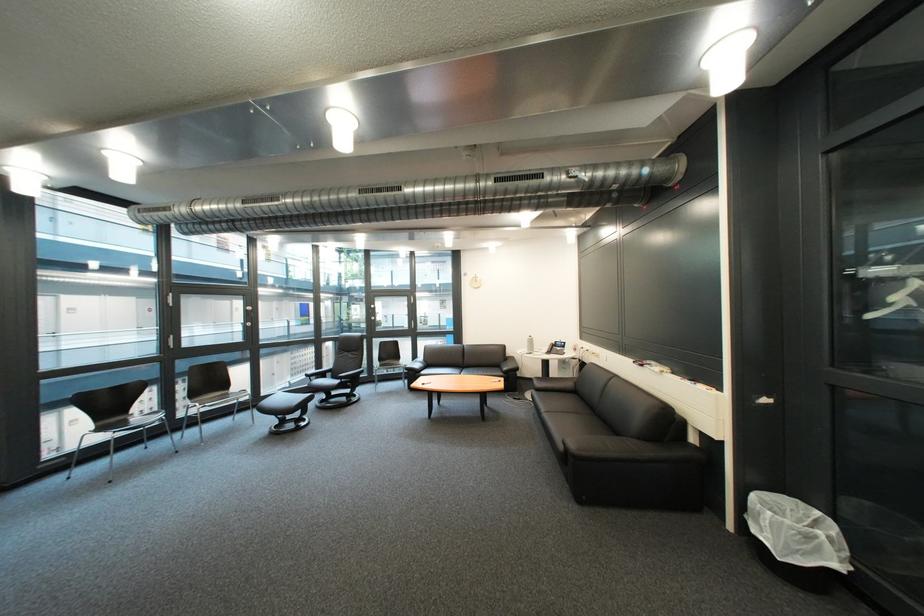
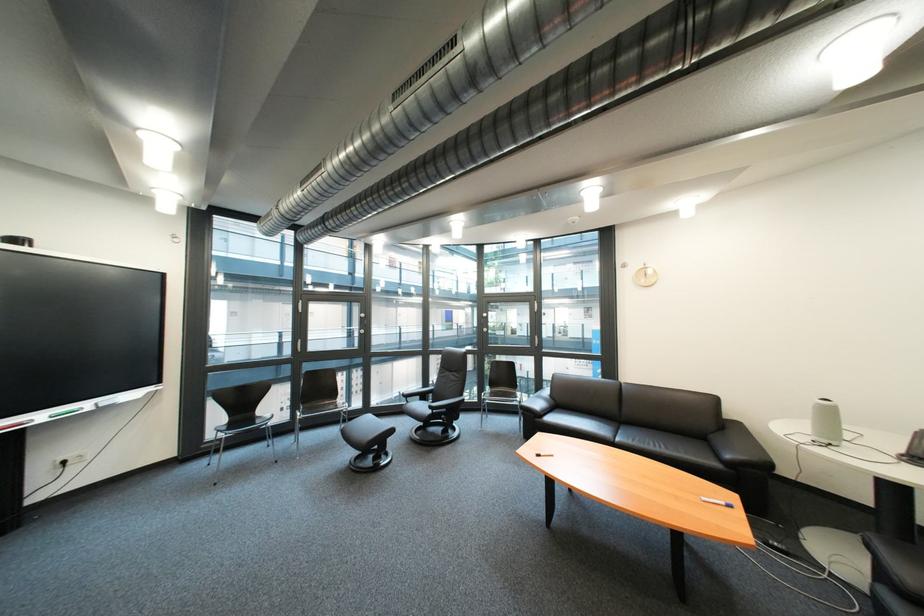
The point at (324, 379) is marked in the first image. Where is the corresponding point in the second image?

(421, 400)